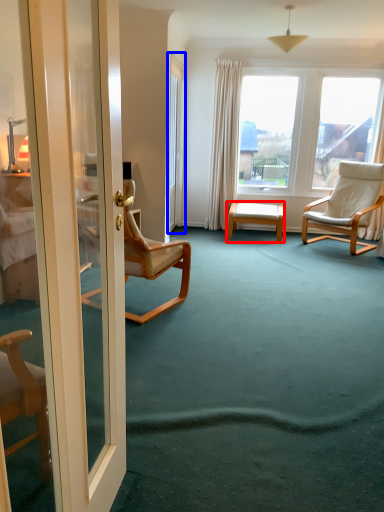
Question: Which object appears farthest to the camera in this image, table (highlighted by a red box) or glass door (highlighted by a blue box)?

Choices:
 (A) table
 (B) glass door

Answer: (A)